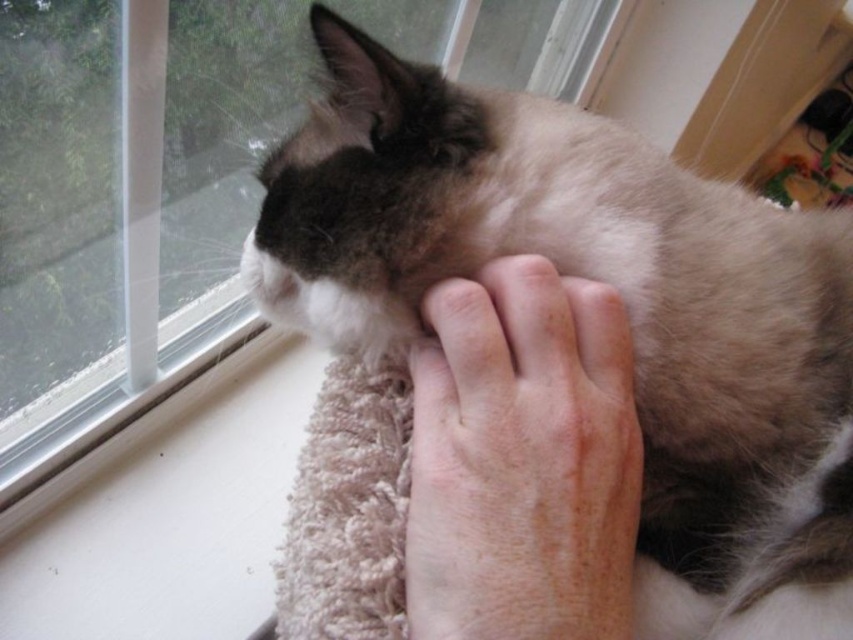
You are a homeowner checking the structural integrity of your home. You notice the dry skin at center and the clear glass window at upper left. Which of these two items is more likely to break under pressure?

The dry skin at center is more likely to break under pressure because it is thinner than the clear glass window at upper left.

You are standing in front of the windowsill where the cat is resting. There are two points marked on the windowsill at coordinates point (485, 468) and point (184, 230). Which point is closer to you?

Point (485, 468) is closer to the viewer than point (184, 230).

You are a veterinarian examining an image of a cat on a windowsill. You notice a point labeled as point (521, 460). Based on the description, what does this point likely represent on the cat?

The point (521, 460) corresponds to dry skin at center, so it likely represents an area of dry skin on the cat.